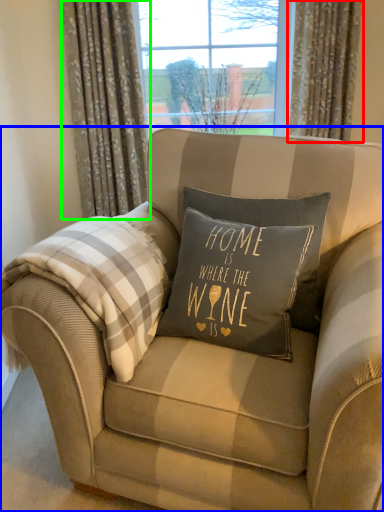
Question: Based on their relative distances, which object is nearer to curtain (highlighted by a red box)? Choose from chair (highlighted by a blue box) and curtain (highlighted by a green box).

Choices:
 (A) chair
 (B) curtain

Answer: (B)